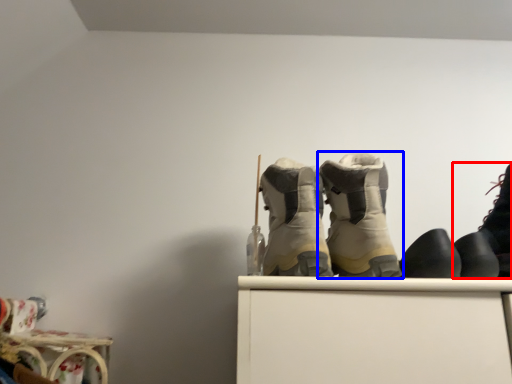
Question: Which object appears farthest to the camera in this image, footwear (highlighted by a red box) or footwear (highlighted by a blue box)?

Choices:
 (A) footwear
 (B) footwear

Answer: (B)